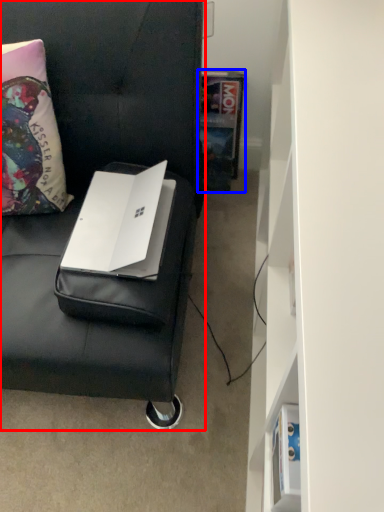
Question: Which of the following is the closest to the observer, furniture (highlighted by a red box) or book (highlighted by a blue box)?

Choices:
 (A) furniture
 (B) book

Answer: (A)